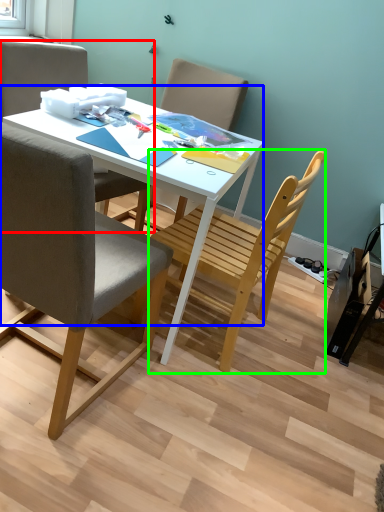
Question: Which object is the closest to the chair (highlighted by a red box)? Choose among these: desk (highlighted by a blue box) or chair (highlighted by a green box).

Choices:
 (A) desk
 (B) chair

Answer: (A)